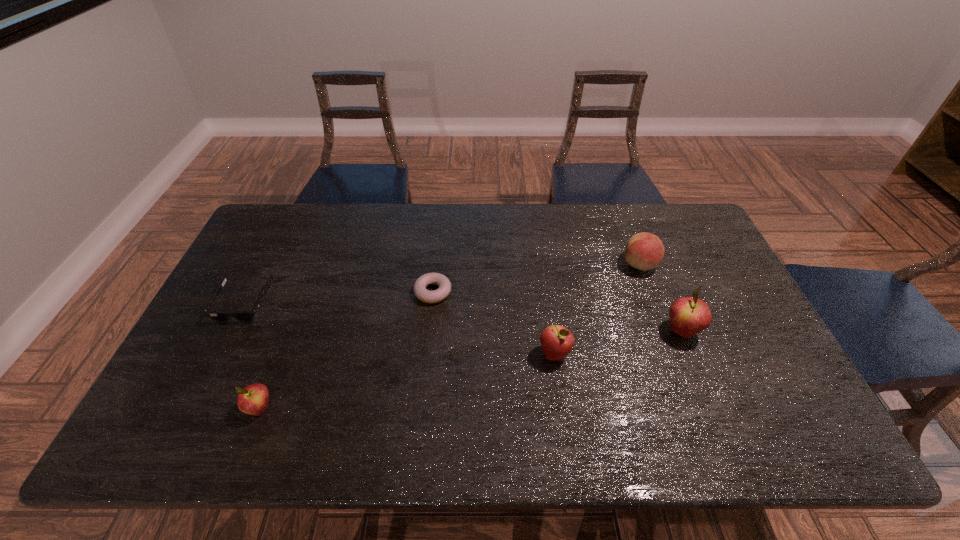
Locate an element on the screen. vacant space at the near edge of the desktop is located at coordinates (585, 397).

Image resolution: width=960 pixels, height=540 pixels. I want to click on vacant space at the left edge of the desktop, so click(205, 335).

Where is `blank space at the right edge of the desktop`? This screenshot has width=960, height=540. blank space at the right edge of the desktop is located at coordinates (711, 284).

Find the location of a particular element. The width and height of the screenshot is (960, 540). free space at the near left corner of the desktop is located at coordinates (223, 396).

Locate an element on the screen. The width and height of the screenshot is (960, 540). free space at the near right corner of the desktop is located at coordinates (791, 399).

At what (x,y) coordinates should I click in order to perform the action: click on empty space between the second apple from left to right and the nearest apple. Please return your answer as a coordinate pair (x, y). The image size is (960, 540). Looking at the image, I should click on (407, 381).

Image resolution: width=960 pixels, height=540 pixels. Find the location of `vacant space that is in between the shortest object and the leftmost object`. vacant space that is in between the shortest object and the leftmost object is located at coordinates (339, 298).

This screenshot has height=540, width=960. Find the location of `empty location between the leftmost apple and the tallest apple`. empty location between the leftmost apple and the tallest apple is located at coordinates (470, 370).

You are a GUI agent. You are given a task and a screenshot of the screen. Output one action in this format:
    pyautogui.click(x=<x>, y=<y>)
    Task: Click on the empty space that is in between the nearest object and the third object from right to left
    Image resolution: width=960 pixels, height=540 pixels.
    Given the screenshot: What is the action you would take?
    pyautogui.click(x=407, y=381)

Identify the location of vacant point located between the second object from left to right and the fourth object from right to left. (347, 350).